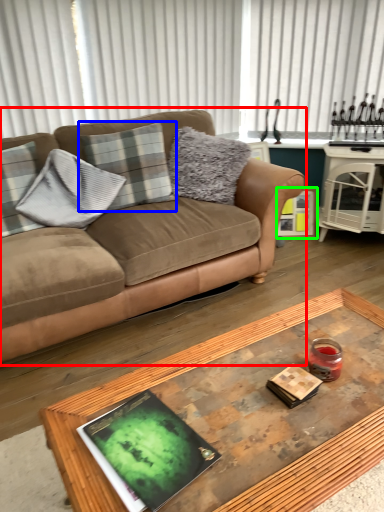
Question: Which object is positioned closest to studio couch (highlighted by a red box)? Select from pillow (highlighted by a blue box) and picture frame (highlighted by a green box).

Choices:
 (A) pillow
 (B) picture frame

Answer: (A)